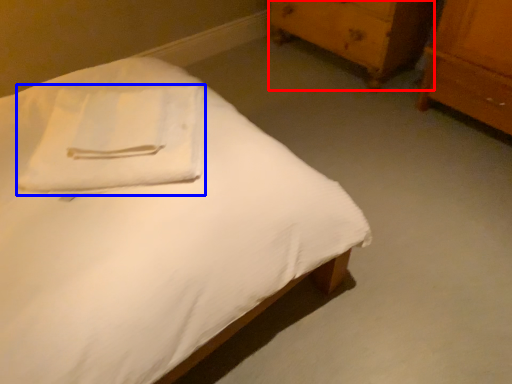
Question: Which point is closer to the camera, chest of drawers (highlighted by a red box) or cloth (highlighted by a blue box)?

Choices:
 (A) chest of drawers
 (B) cloth

Answer: (B)